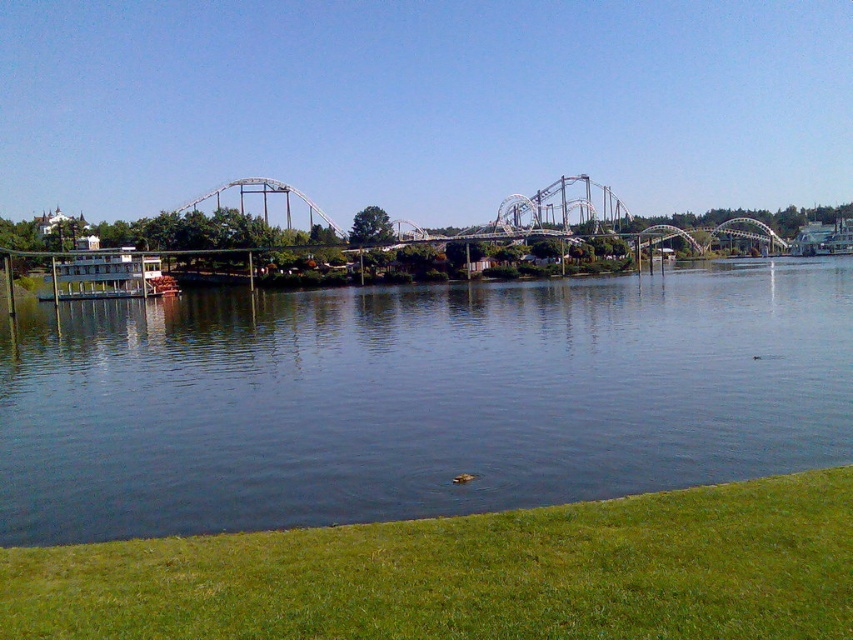
Measure the distance between dark blue water at center and green grass at lower right.

dark blue water at center and green grass at lower right are 35.81 meters apart.

Does dark blue water at center have a lesser height compared to green grass at lower right?

No, dark blue water at center is not shorter than green grass at lower right.

Image resolution: width=853 pixels, height=640 pixels. I want to click on dark blue water at center, so click(416, 397).

Does dark blue water at center lie behind white matte roller coaster at upper center?

No, dark blue water at center is in front of white matte roller coaster at upper center.

Which is below, dark blue water at center or white matte roller coaster at upper center?

dark blue water at center

Between point (379, 420) and point (231, 237), which one is positioned behind?

Positioned behind is point (231, 237).

Locate an element on the screen. This screenshot has height=640, width=853. dark blue water at center is located at coordinates (416, 397).

Does white matte roller coaster at upper center have a lesser width compared to metallic gray boat at center-left?

Incorrect, white matte roller coaster at upper center's width is not less than metallic gray boat at center-left's.

Who is higher up, white matte roller coaster at upper center or metallic gray boat at center-left?

white matte roller coaster at upper center is higher up.

Locate an element on the screen. The width and height of the screenshot is (853, 640). white matte roller coaster at upper center is located at coordinates (402, 241).

What are the coordinates of `white matte roller coaster at upper center` in the screenshot? It's located at (402, 241).